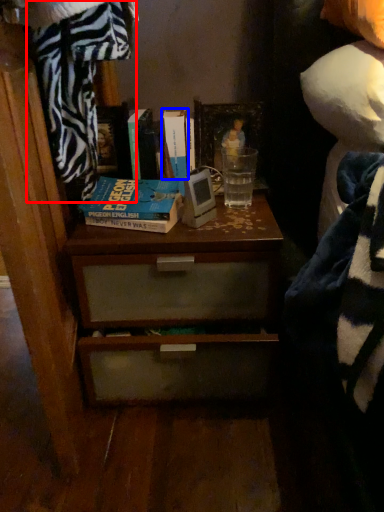
Question: Among these objects, which one is farthest to the camera, blanket (highlighted by a red box) or book (highlighted by a blue box)?

Choices:
 (A) blanket
 (B) book

Answer: (B)